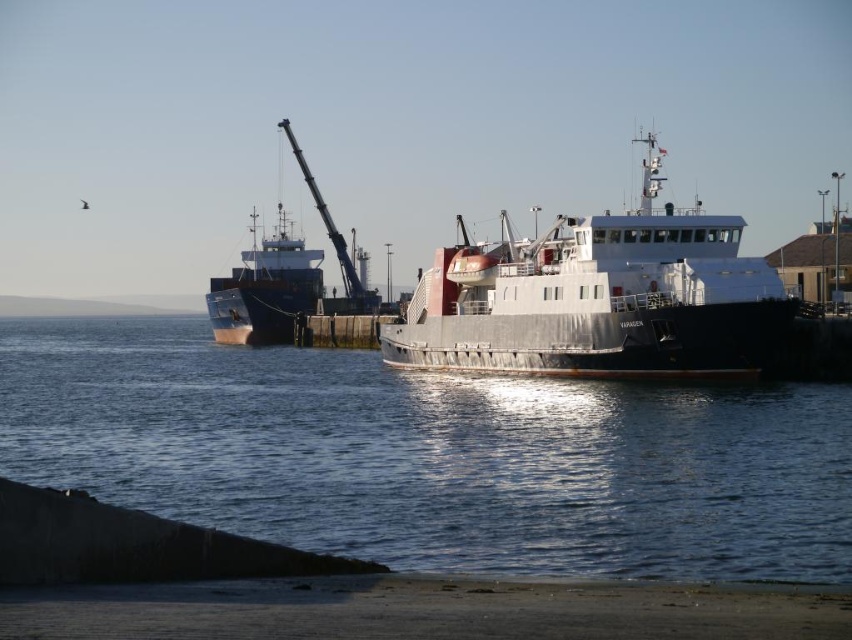
Question: Among these points, which one is nearest to the camera?

Choices:
 (A) (93, 477)
 (B) (717, 280)
 (C) (262, 320)

Answer: (A)

Question: Does metallic gray ferry at center have a smaller size compared to blue matte cargo ship at center?

Choices:
 (A) yes
 (B) no

Answer: (B)

Question: Is clear water at center closer to camera compared to metallic gray ferry at center?

Choices:
 (A) yes
 (B) no

Answer: (A)

Question: Estimate the real-world distances between objects in this image. Which object is farther from the metallic gray ferry at center?

Choices:
 (A) blue matte cargo ship at center
 (B) clear water at center

Answer: (A)

Question: Which object is positioned farthest from the clear water at center?

Choices:
 (A) blue matte cargo ship at center
 (B) metallic gray ferry at center

Answer: (A)

Question: Is metallic gray ferry at center wider than blue matte cargo ship at center?

Choices:
 (A) yes
 (B) no

Answer: (A)